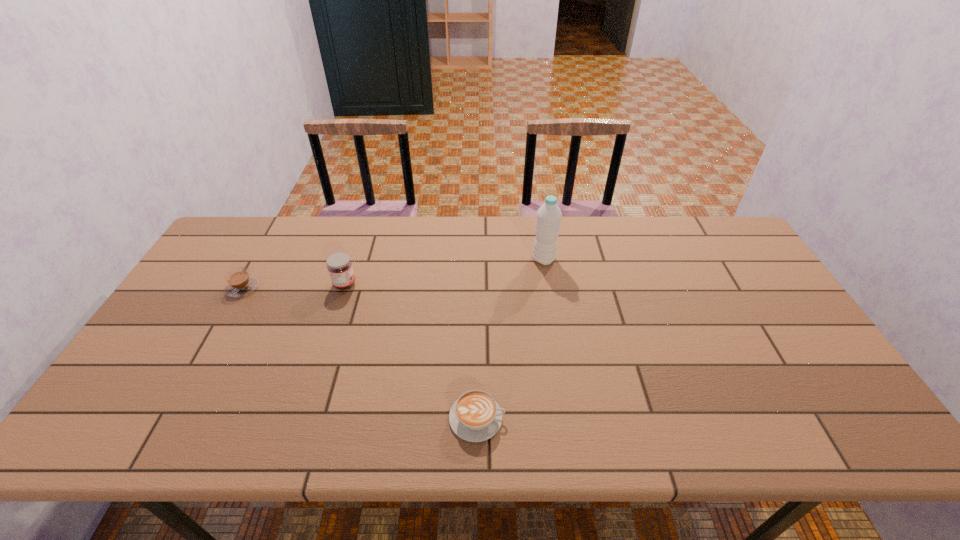
Identify the location of vacant space situated on the front of the leftmost object. Image resolution: width=960 pixels, height=540 pixels. (182, 395).

At what (x,y) coordinates should I click in order to perform the action: click on vacant space situated 0.160m on the side of the second object from right to left with the handle. Please return your answer as a coordinate pair (x, y). Looking at the image, I should click on (574, 418).

Identify the location of object located at the far edge. This screenshot has width=960, height=540. (548, 220).

What are the coordinates of `object situated at the near edge` in the screenshot? It's located at (475, 416).

At what (x,y) coordinates should I click in order to perform the action: click on object positioned at the left edge. Please return your answer as a coordinate pair (x, y). Looking at the image, I should click on (239, 283).

Locate an element on the screen. This screenshot has height=540, width=960. vacant space at the far edge of the desktop is located at coordinates (463, 217).

In the image, there is a desktop. Identify the location of free space at the near edge. (516, 437).

Where is `blank space at the right edge of the desktop`? blank space at the right edge of the desktop is located at coordinates coord(774,329).

Image resolution: width=960 pixels, height=540 pixels. I want to click on free space at the near left corner, so click(x=160, y=418).

Find the location of a particular element. free space at the near right corner of the desktop is located at coordinates (827, 424).